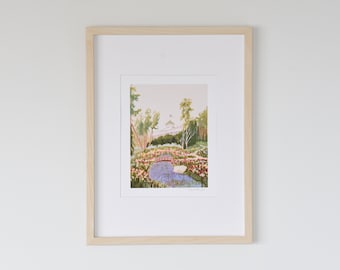
The image size is (340, 270). I want to click on bottom right corner of frame, so click(247, 239).